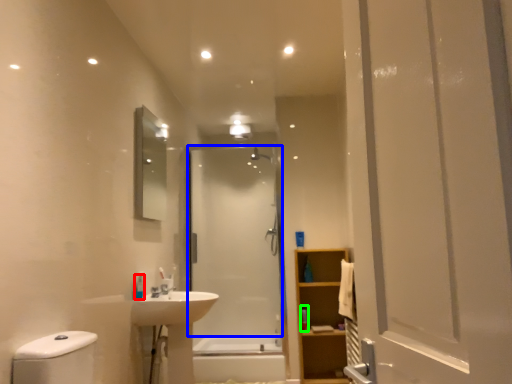
Question: Which object is the closest to the toiletry (highlighted by a red box)? Choose among these: screen door (highlighted by a blue box) or toiletry (highlighted by a green box).

Choices:
 (A) screen door
 (B) toiletry

Answer: (B)